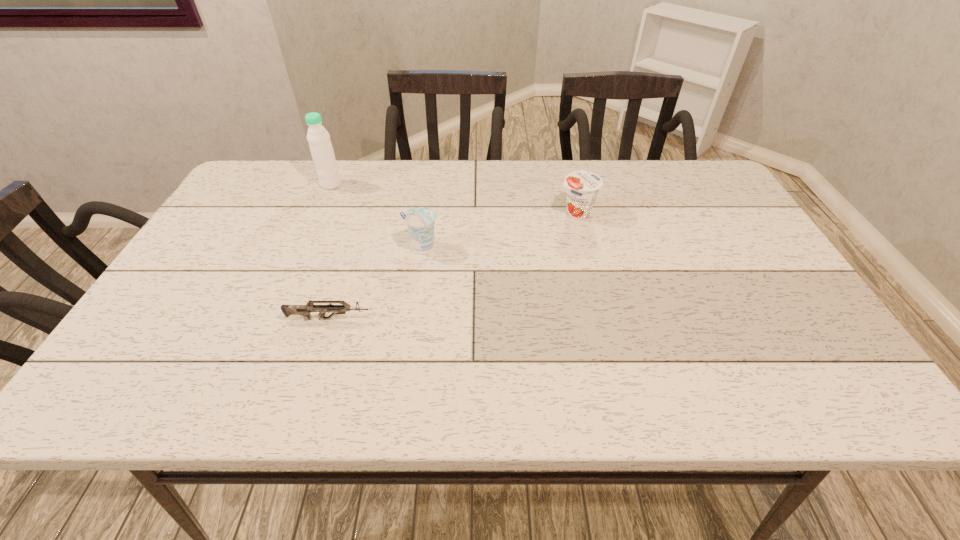
This screenshot has height=540, width=960. Identify the location of blank region between the shortest object and the water bottle. (331, 252).

Identify the location of unoccupied area between the water bottle and the right yogurt. (454, 199).

The height and width of the screenshot is (540, 960). Identify the location of free space between the nearer yogurt and the farther yogurt. (499, 230).

Identify the location of free space between the left yogurt and the shortest object. Image resolution: width=960 pixels, height=540 pixels. (376, 283).

Locate an element on the screen. free spot between the tallest object and the rightmost object is located at coordinates (454, 199).

Image resolution: width=960 pixels, height=540 pixels. What are the coordinates of `empty location between the left yogurt and the nearest object` in the screenshot? It's located at (376, 283).

Locate an element on the screen. vacant space that's between the rightmost object and the farthest object is located at coordinates (454, 199).

I want to click on free space between the left yogurt and the shortest object, so click(x=376, y=283).

This screenshot has width=960, height=540. Identify the location of object that can be found as the closest to the rightmost object. (420, 221).

Locate which object ranks second in proximity to the second nearest object. Please provide its 2D coordinates. Your answer should be formatted as a tuple, i.e. [(x, y)], where the tuple contains the x and y coordinates of a point satisfying the conditions above.

[(318, 137)]